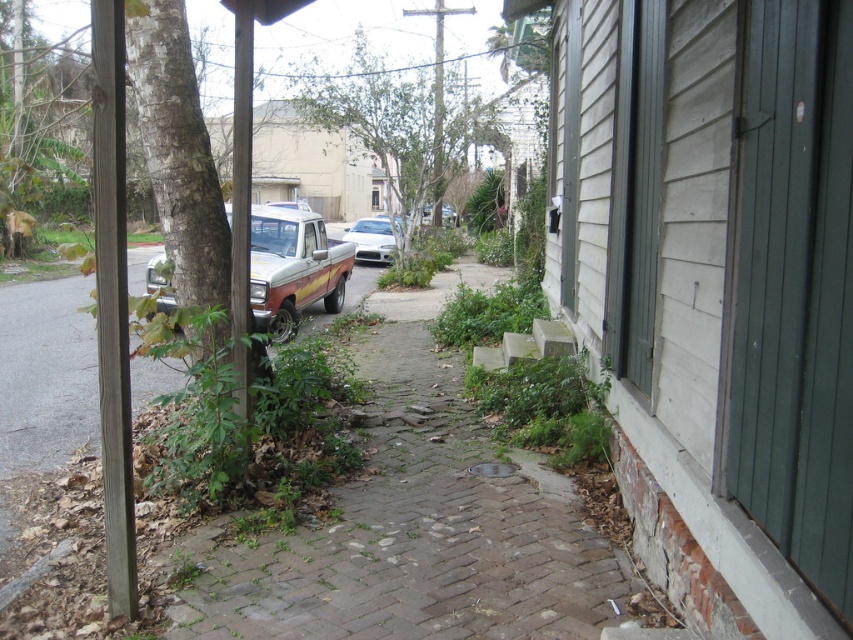
Question: Does rustic wood pickup truck at center-left have a smaller size compared to white glossy sedan at center?

Choices:
 (A) yes
 (B) no

Answer: (B)

Question: Which is farther from the brick paved path at center?

Choices:
 (A) rustic wood pickup truck at center-left
 (B) white glossy sedan at center
 (C) green leafy tree at center

Answer: (B)

Question: Which is nearer to the green leafy tree at center?

Choices:
 (A) brick paved path at center
 (B) rustic wood pickup truck at center-left
 (C) white glossy sedan at center

Answer: (C)

Question: Does brick paved path at center come behind white glossy sedan at center?

Choices:
 (A) yes
 (B) no

Answer: (B)

Question: Can you confirm if brick paved path at center is bigger than green leafy tree at center?

Choices:
 (A) no
 (B) yes

Answer: (B)

Question: Which point is farther from the camera taking this photo?

Choices:
 (A) (404, 451)
 (B) (387, 116)
 (C) (387, 259)

Answer: (C)